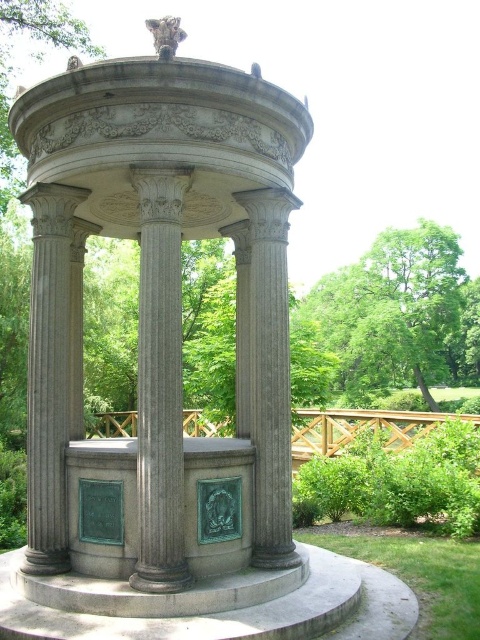
Question: Which of these objects is positioned closest to the gray stone column at center?

Choices:
 (A) green leafy tree at upper right
 (B) gray stone gazebo at center
 (C) gray stone column at left

Answer: (C)

Question: Can you confirm if gray stone gazebo at center is positioned above gray stone column at center?

Choices:
 (A) yes
 (B) no

Answer: (A)

Question: Is gray stone gazebo at center thinner than green leafy tree at upper right?

Choices:
 (A) yes
 (B) no

Answer: (A)

Question: Based on their relative distances, which object is farther from the gray stone gazebo at center?

Choices:
 (A) green leafy tree at upper right
 (B) gray stone column at center
 (C) gray marble column at center

Answer: (A)

Question: Does green leafy tree at upper right have a larger size compared to gray marble column at center?

Choices:
 (A) yes
 (B) no

Answer: (A)

Question: Which object is positioned farthest from the gray marble column at center?

Choices:
 (A) gray stone column at left
 (B) gray stone gazebo at center

Answer: (B)